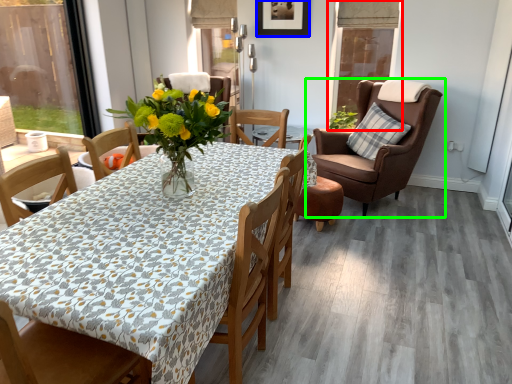
Question: Based on their relative distances, which object is nearer to window screen (highlighted by a red box)? Choose from picture frame (highlighted by a blue box) and chair (highlighted by a green box).

Choices:
 (A) picture frame
 (B) chair

Answer: (B)